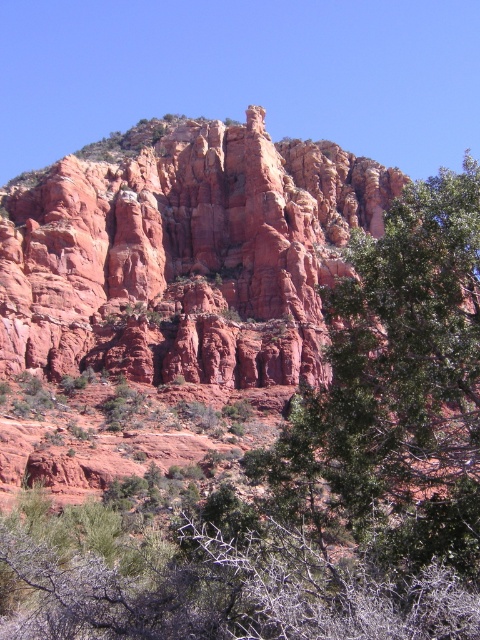
Between reddish-brown rock formation at center and green leafy tree at center, which one appears on the right side from the viewer's perspective?

Positioned to the right is green leafy tree at center.

Can you confirm if reddish-brown rock formation at center is smaller than green leafy tree at center?

Correct, reddish-brown rock formation at center occupies less space than green leafy tree at center.

Is point (3, 266) farther from camera compared to point (382, 435)?

Yes, it is.

Identify the location of reddish-brown rock formation at center. (183, 253).